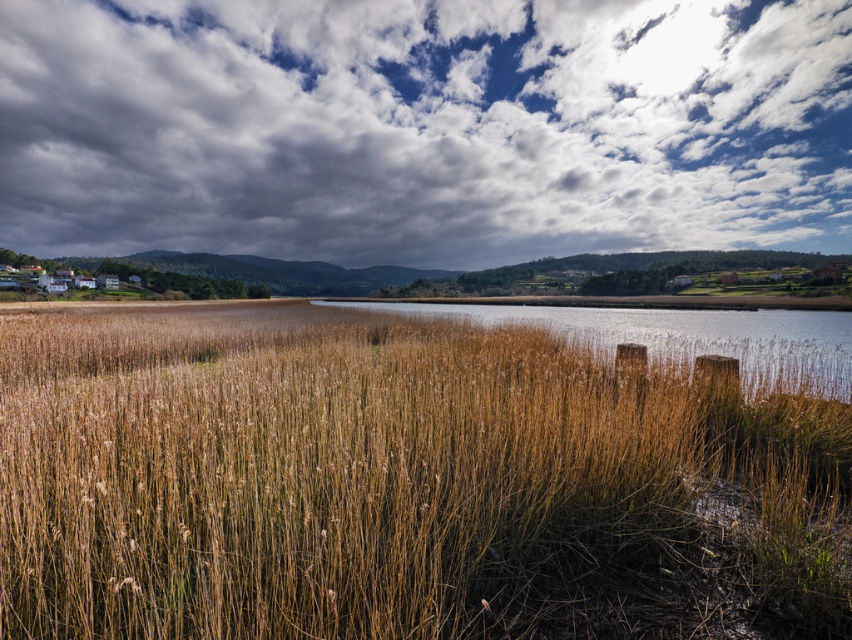
From the picture: You are standing in the middle of the reeds and want to look up at the cloudy sky at upper center. Which direction should you turn to see the brown dry grass at center?

You should turn to your left to see the brown dry grass at center, which is positioned to the left of the cloudy sky at upper center.

Looking at this image, you are an artist trying to paint this landscape. You want to ensure the brown dry grass at center and cloudy sky at upper center are proportionally accurate. Which object should you paint smaller?

The brown dry grass at center should be painted smaller than the cloudy sky at upper center because the description states that the brown dry grass at center is smaller than the cloudy sky at upper center.

You are standing at the edge of the reed area in the scene. You see the brown dry grass at center and the brown grassy reeds at center. Which one is closer to you?

The brown dry grass at center is closer to you because it is in front of the brown grassy reeds at center.